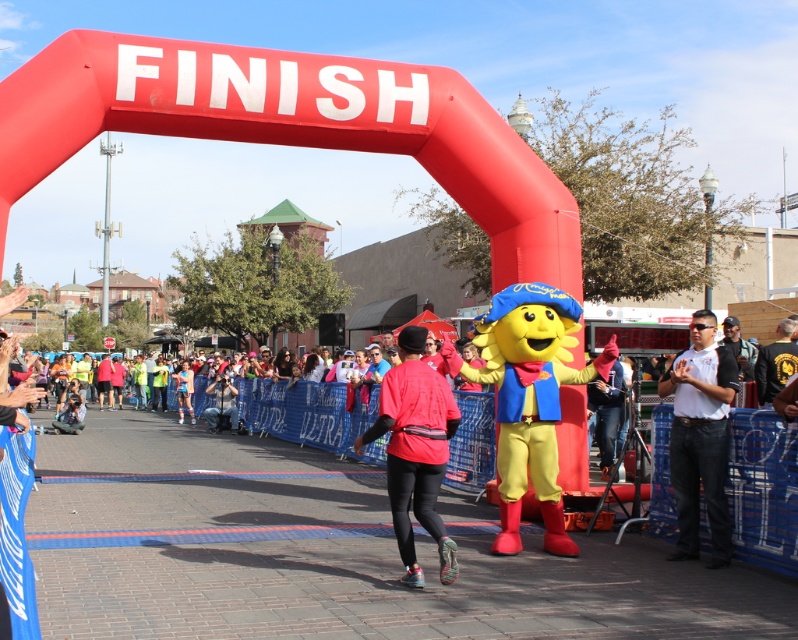
Question: Is red matte running outfit at center above white shirt at center?

Choices:
 (A) yes
 (B) no

Answer: (A)

Question: Can you confirm if red matte running outfit at center is bigger than white shirt at center?

Choices:
 (A) yes
 (B) no

Answer: (A)

Question: Observing the image, what is the correct spatial positioning of red matte running outfit at center in reference to white shirt at center?

Choices:
 (A) right
 (B) left

Answer: (B)

Question: Which of the following is the farthest from the observer?

Choices:
 (A) red matte running outfit at center
 (B) white shirt at center

Answer: (B)